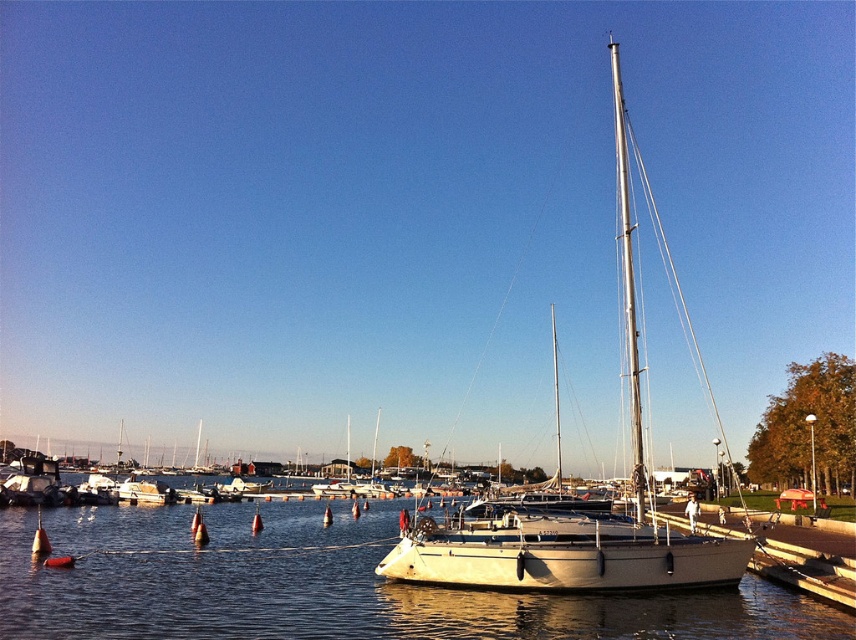
You are a photographer standing at the edge of the marina, aiming to capture the white matte water at center and the white matte sailboat at center in a single shot. Based on their heights, which object will appear closer to the bottom of the photo?

The white matte water at center has a lesser height compared to the white matte sailboat at center, so it will appear closer to the bottom of the photo.